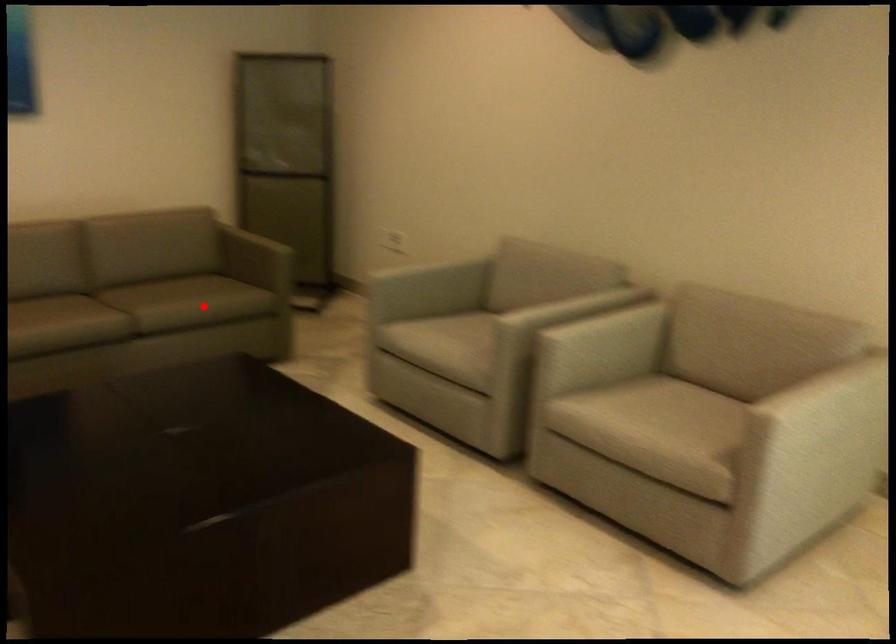
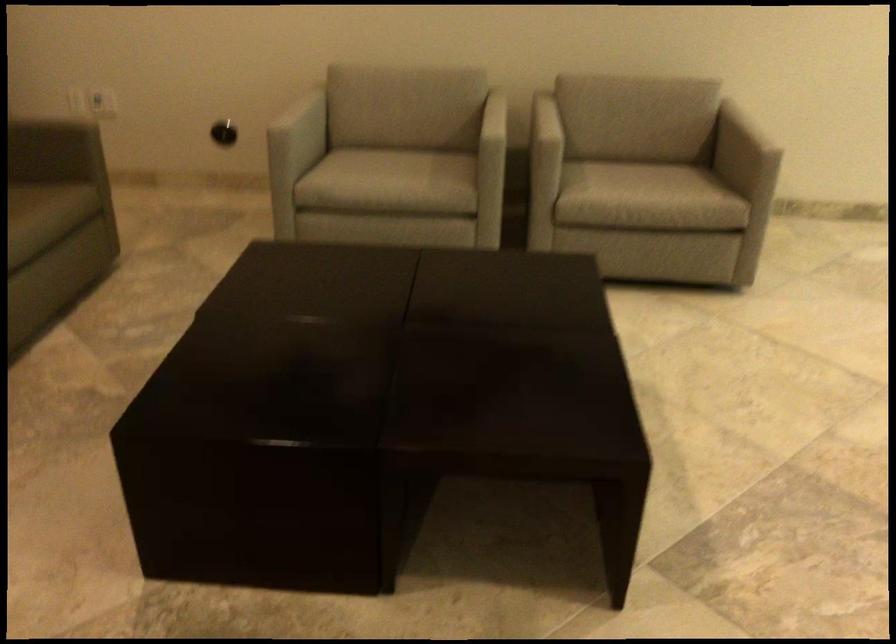
Question: I am providing you with two images of the same scene from different viewpoints. A red point is marked on the first image. Can you still see the location of the red point in image 2?

Choices:
 (A) Yes
 (B) No

Answer: (A)